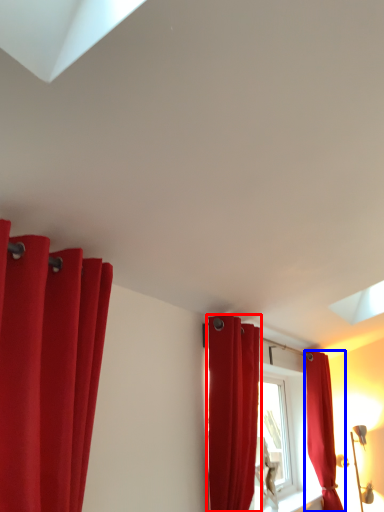
Question: Which of the following is the farthest to the observer, curtain (highlighted by a red box) or curtain (highlighted by a blue box)?

Choices:
 (A) curtain
 (B) curtain

Answer: (B)